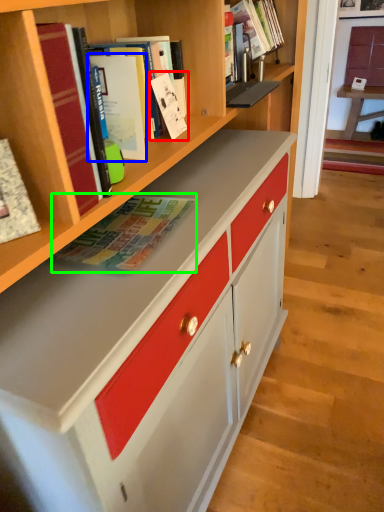
Question: Considering the real-world distances, which object is farthest from book (highlighted by a red box)? paperback book (highlighted by a blue box) or book (highlighted by a green box)?

Choices:
 (A) paperback book
 (B) book

Answer: (B)